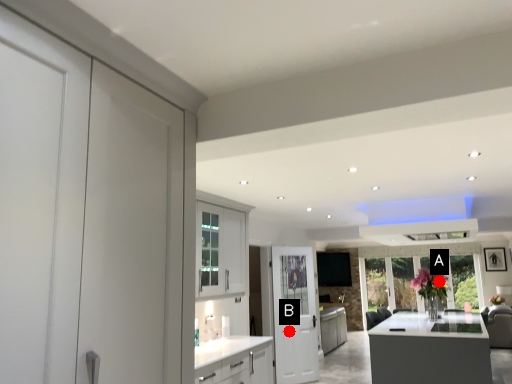
Question: Two points are circled on the image, labeled by A and B beside each circle. Among these points, which one is nearest to the camera?

Choices:
 (A) A is closer
 (B) B is closer

Answer: (B)